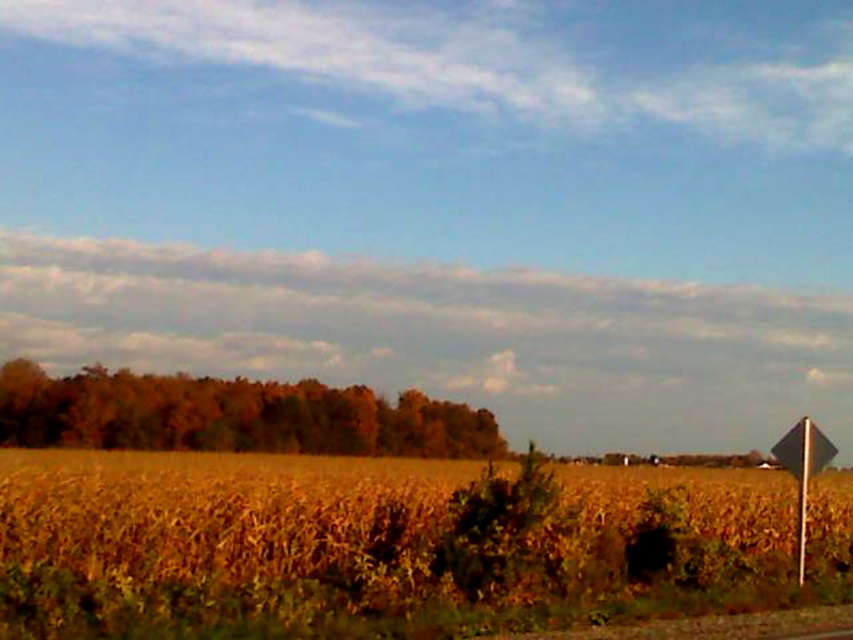
Question: Can you confirm if brown matte trees at center is bigger than metallic diamond-shaped sign at right?

Choices:
 (A) yes
 (B) no

Answer: (A)

Question: Among these points, which one is farthest from the camera?

Choices:
 (A) (785, 547)
 (B) (798, 531)

Answer: (A)

Question: Among these points, which one is nearest to the camera?

Choices:
 (A) (799, 582)
 (B) (265, 474)
 (C) (802, 550)
 (D) (70, 424)

Answer: (A)

Question: Does golden wheat field at center appear under metallic pole at right?

Choices:
 (A) yes
 (B) no

Answer: (A)

Question: Does golden wheat field at center appear over metallic pole at right?

Choices:
 (A) no
 (B) yes

Answer: (A)

Question: Which point appears closest to the camera in this image?

Choices:
 (A) (602, 506)
 (B) (802, 444)

Answer: (B)